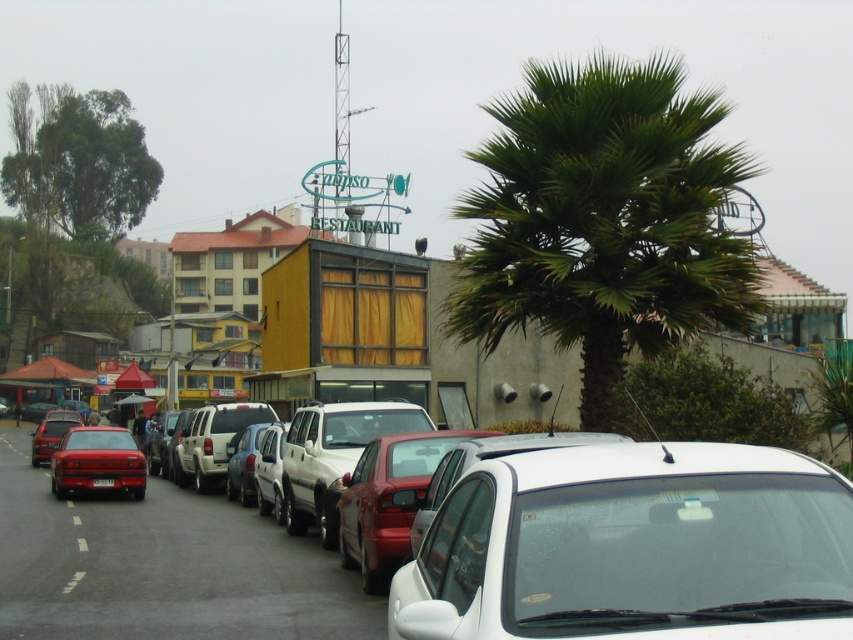
You are a delivery driver who needs to park your vehicle near the Tulipso Restaurant. The parking spot you want is at coordinates point 0.856, 0.744. Is the white glossy car at center currently occupying that spot?

The white glossy car at center is located at point (634, 547), so yes, it is occupying the parking spot you want.

You are a delivery person driving a truck that is 2 meters wide. You need to park your truck between the white glossy car at center and the matte red car at center. Is there enough space between them to fit your truck?

The white glossy car at center is positioned on the right side of matte red car at center, but the exact distance between them isn not provided. Without knowing the space between them, it is impossible to determine if the truck can fit.

In the scene shown: You are standing on the sidewalk looking at the street scene. There are two points marked in the image, one at coordinate point (612,337) and the other at point (59,481). Which point is closer to you?

Point (612,337) is closer to the viewer than point (59,481).